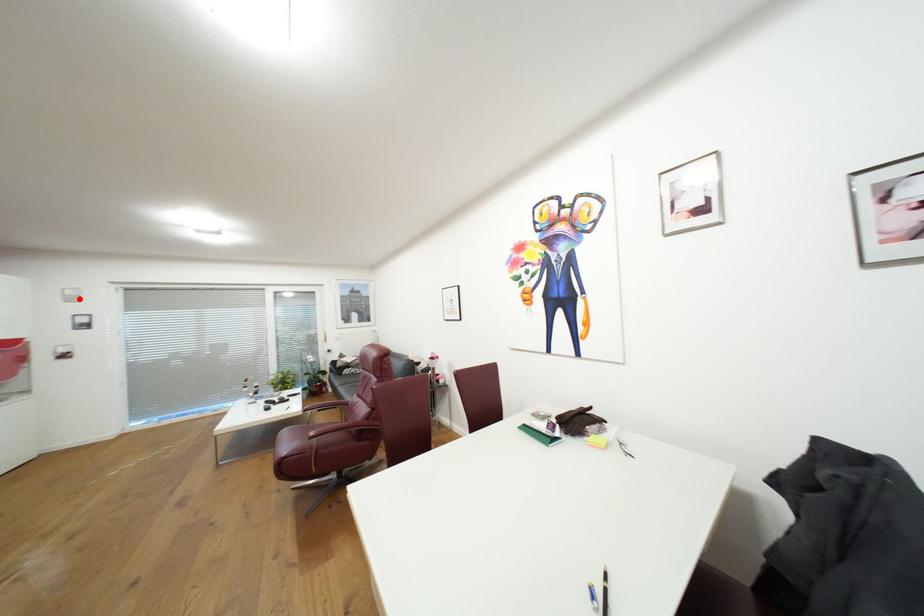
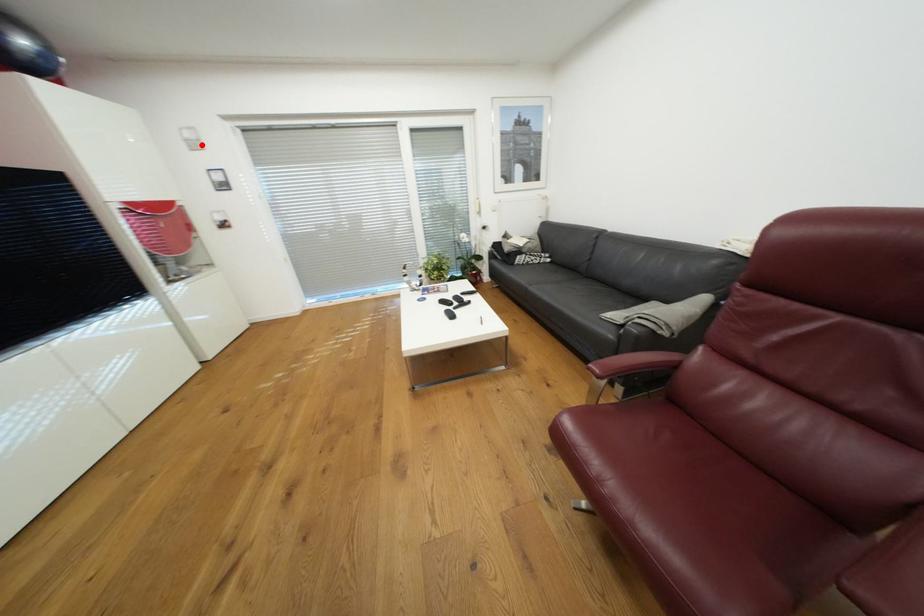
I am providing you with two images of the same scene from different viewpoints. A red point is marked on the first image and another point is marked on the second image. Is the red point in image1 aligned with the point shown in image2?

Yes